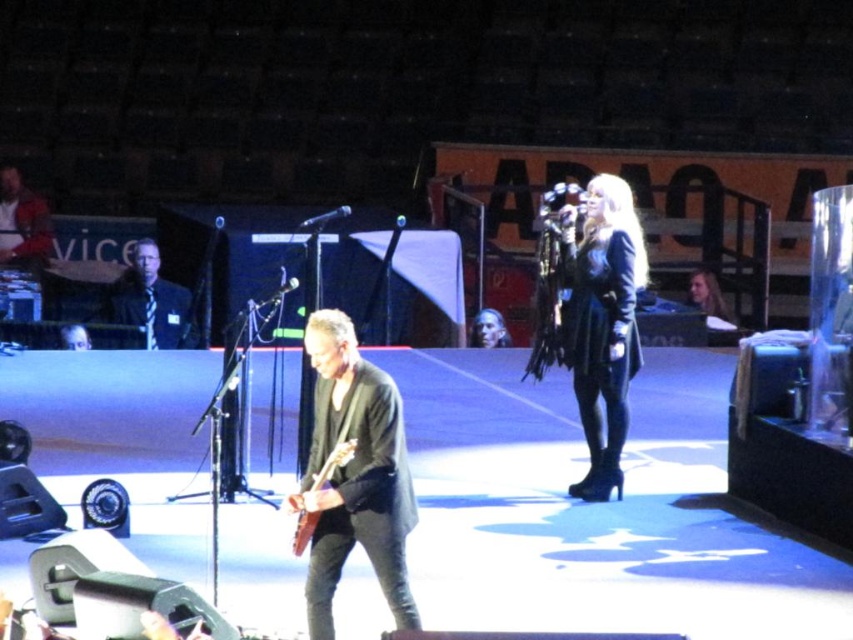
Question: Is black leather jacket at center smaller than wooden electric guitar at center?

Choices:
 (A) no
 (B) yes

Answer: (A)

Question: Estimate the real-world distances between objects in this image. Which object is farther from the black leather jacket at center?

Choices:
 (A) wooden electric guitar at center
 (B) dark gray leather jacket at center

Answer: (A)

Question: Which point is closer to the camera taking this photo?

Choices:
 (A) (299, 499)
 (B) (601, 250)
 (C) (157, 296)
 (D) (331, 524)

Answer: (A)

Question: Does black leather jacket at left have a larger size compared to wooden electric guitar at center?

Choices:
 (A) no
 (B) yes

Answer: (B)

Question: Which object is farther from the camera taking this photo?

Choices:
 (A) dark gray leather jacket at center
 (B) black leather jacket at left
 (C) black leather jacket at center

Answer: (B)

Question: Considering the relative positions of black leather jacket at center and wooden electric guitar at center in the image provided, where is black leather jacket at center located with respect to wooden electric guitar at center?

Choices:
 (A) left
 (B) right

Answer: (B)